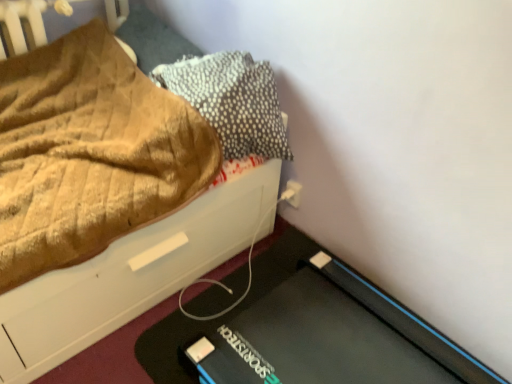
Question: From a real-world perspective, is brown textured pillow at upper left, placed as the 2th pillow when sorted from right to left, positioned above or below white plastic electric outlet at lower right?

Choices:
 (A) below
 (B) above

Answer: (B)

Question: Is brown textured pillow at upper left, placed as the 2th pillow when sorted from right to left, spatially inside white plastic electric outlet at lower right, or outside of it?

Choices:
 (A) inside
 (B) outside

Answer: (B)

Question: Estimate the real-world distances between objects in this image. Which object is closer to the textured gray pillow at upper right, which is the second pillow from left to right?

Choices:
 (A) white plastic electric outlet at lower right
 (B) brown textured fabric at upper left
 (C) brown textured pillow at upper left, placed as the 2th pillow when sorted from right to left

Answer: (B)

Question: Which of these objects is positioned farthest from the textured gray pillow at upper right, which is the second pillow from left to right?

Choices:
 (A) white plastic electric outlet at lower right
 (B) brown textured pillow at upper left, positioned as the 1th pillow in left-to-right order
 (C) brown textured fabric at upper left

Answer: (A)